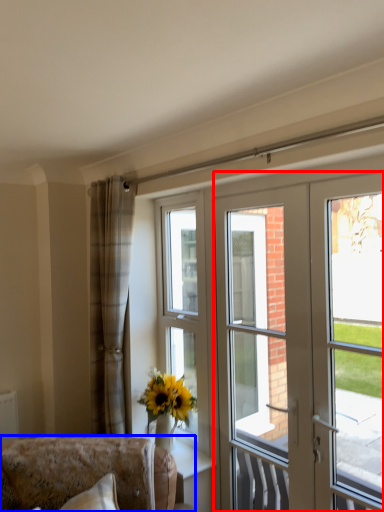
Question: Which object appears farthest to the camera in this image, door (highlighted by a red box) or furniture (highlighted by a blue box)?

Choices:
 (A) door
 (B) furniture

Answer: (B)